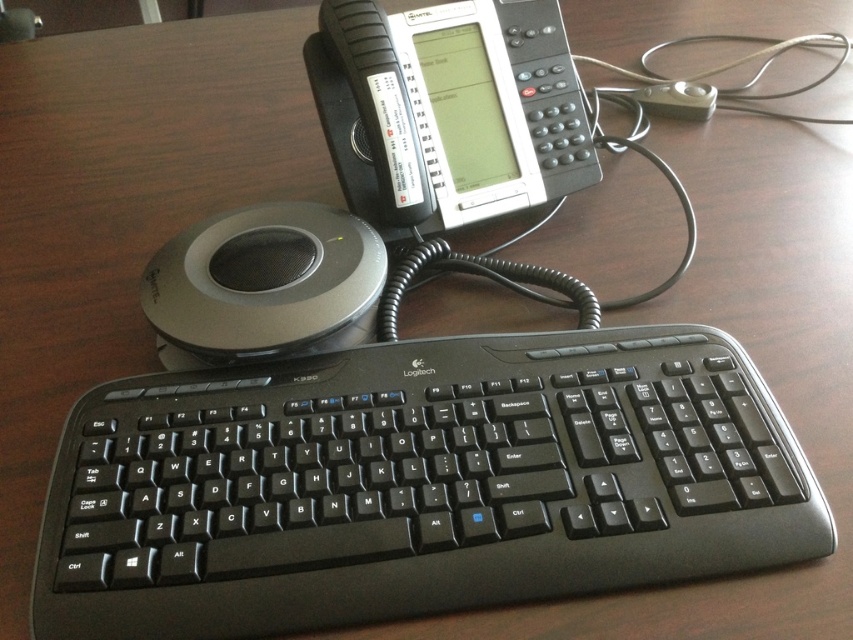
You are taking a photo of the workspace setup. You want to focus on the point closer to the camera between the two points labeled as point (86, 412) and point (572, 144). Which point should you focus on?

You should focus on point (86, 412) because it is closer to the camera than point (572, 144).

You are a delivery person who needs to place a small package on the desk without blocking any devices. The package is 10 inches wide. Is there enough space between the black plastic phone at upper center and the edge of the desk to place the package?

The black plastic phone at upper center and viewer are 21.31 inches apart from each other. Since the package is 10 inches wide, there is sufficient space between the black plastic phone at upper center and the desk edge to place the package.